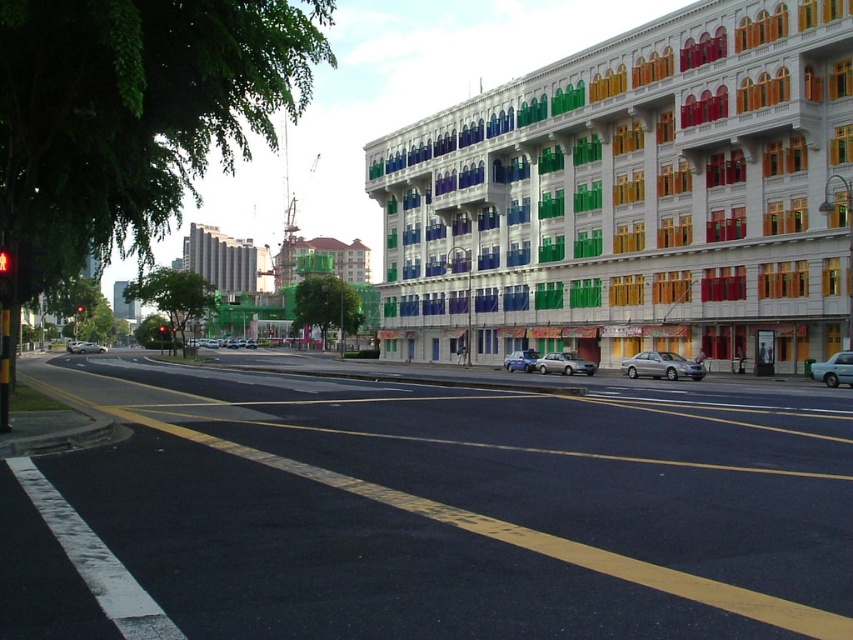
Question: Which of the following is the farthest from the observer?

Choices:
 (A) (12, 273)
 (B) (167, 326)
 (C) (567, 358)

Answer: (B)

Question: Which point is farther from the camera taking this photo?

Choices:
 (A) (167, 330)
 (B) (839, 356)

Answer: (A)

Question: Is silver metallic sedan at center positioned at the back of red glass traffic light at upper center?

Choices:
 (A) no
 (B) yes

Answer: (B)

Question: Among these points, which one is farthest from the camera?

Choices:
 (A) (1, 304)
 (B) (840, 380)
 (C) (80, 342)
 (D) (531, 360)

Answer: (C)

Question: Does satin silver sedan at center have a lesser width compared to silver metallic sedan at center?

Choices:
 (A) no
 (B) yes

Answer: (B)

Question: Observing the image, what is the correct spatial positioning of silver metallic sedan at center-right in reference to red glass traffic light at upper center?

Choices:
 (A) above
 (B) below

Answer: (B)